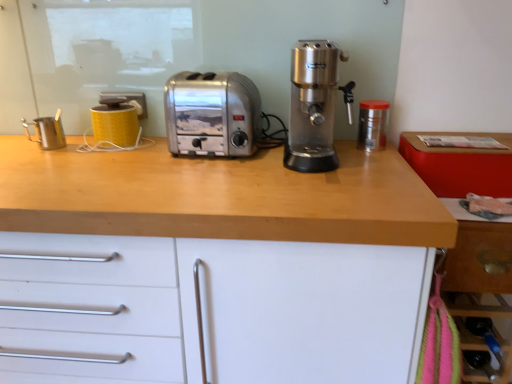
The image size is (512, 384). I want to click on vacant space in front of metallic stainless steel pitcher at left, which ranks as the first kitchen appliance in left-to-right order, so click(38, 156).